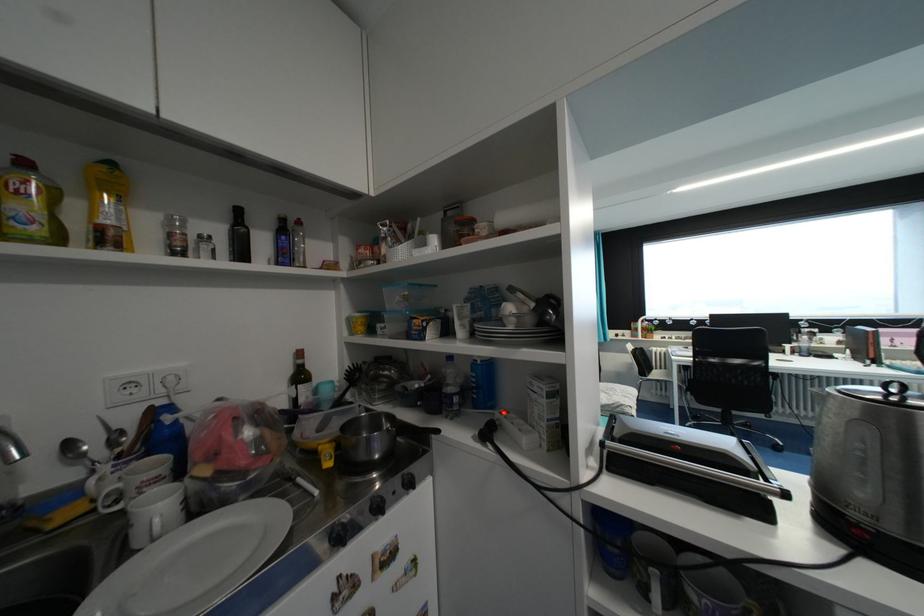
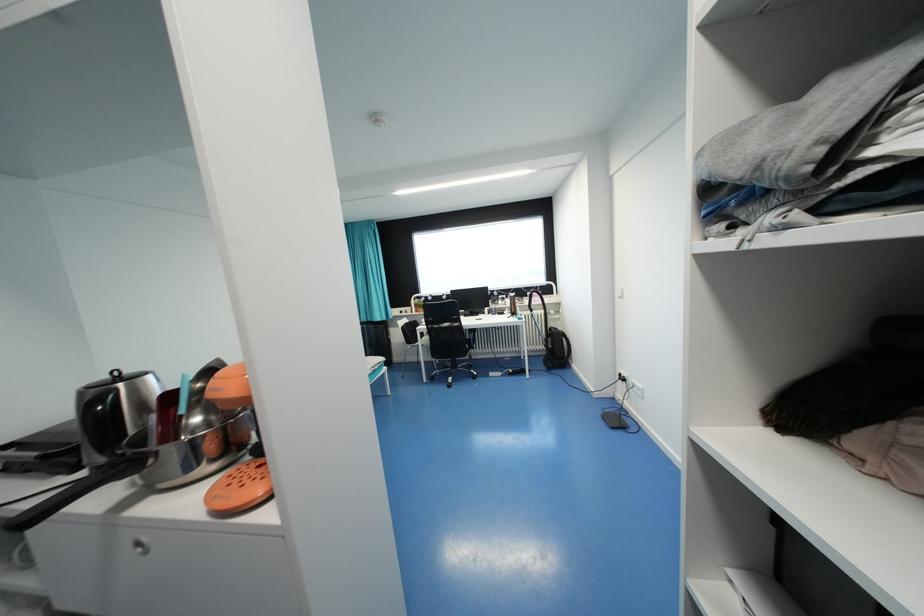
In a continuous first-person perspective shot, in which direction is the camera moving?

The movement direction of the cameraman is right, backward.